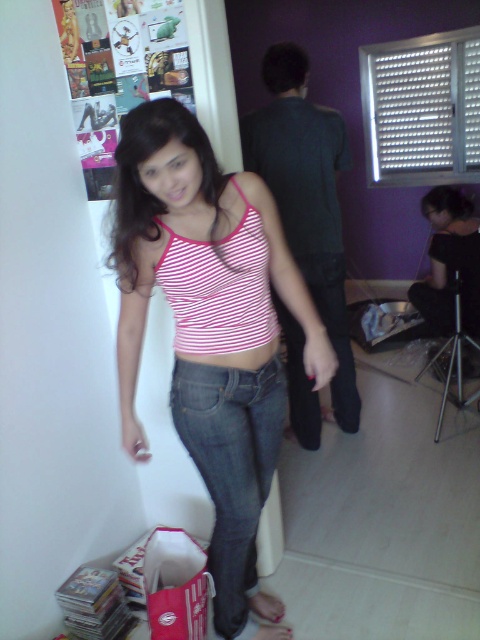
Question: Can you confirm if pink striped tank top at center is smaller than denim at center?

Choices:
 (A) yes
 (B) no

Answer: (B)

Question: Which point is closer to the camera taking this photo?

Choices:
 (A) (337, 349)
 (B) (156, 225)
 (C) (236, 524)

Answer: (B)

Question: Among these objects, which one is farthest from the camera?

Choices:
 (A) denim at center
 (B) pink striped tank top at center
 (C) denim jeans at lower center

Answer: (A)

Question: Which object is farther from the camera taking this photo?

Choices:
 (A) pink striped tank top at center
 (B) denim jeans at lower center

Answer: (B)

Question: Does pink striped tank top at center have a greater width compared to denim at center?

Choices:
 (A) yes
 (B) no

Answer: (A)

Question: Is denim jeans at lower center further to camera compared to denim at center?

Choices:
 (A) yes
 (B) no

Answer: (B)